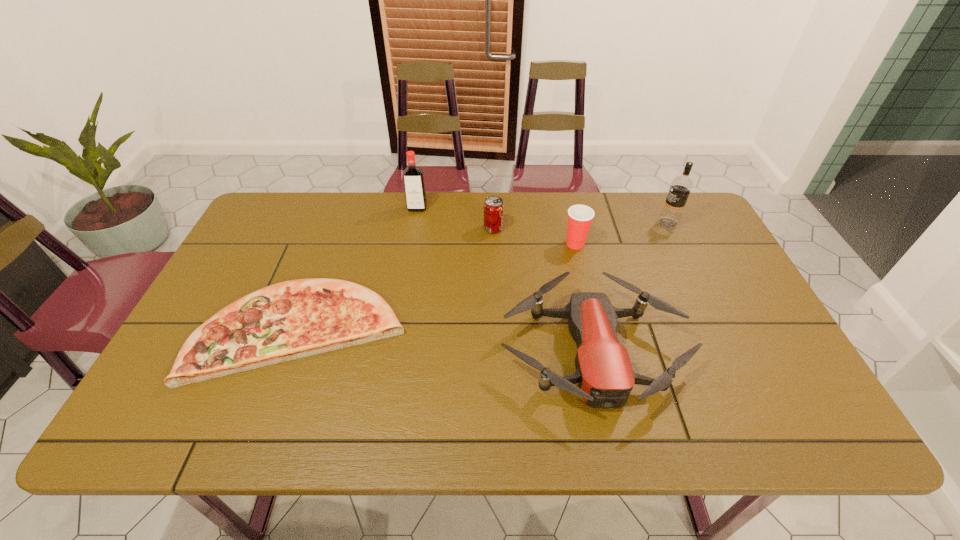
Image resolution: width=960 pixels, height=540 pixels. Identify the location of the right vodka. (681, 186).

Find the location of a particular element. This screenshot has height=540, width=960. the rightmost object is located at coordinates (681, 186).

Image resolution: width=960 pixels, height=540 pixels. Find the location of `the left vodka`. the left vodka is located at coordinates (414, 187).

Image resolution: width=960 pixels, height=540 pixels. In order to click on the farthest object in this screenshot , I will do `click(414, 187)`.

You are a GUI agent. You are given a task and a screenshot of the screen. Output one action in this format:
    pyautogui.click(x=<x>, y=<y>)
    Task: Click on the Dixie cup
    
    Given the screenshot: What is the action you would take?
    (x=580, y=217)

The width and height of the screenshot is (960, 540). In order to click on pop soda in this screenshot , I will do [493, 215].

Identify the location of drone. This screenshot has width=960, height=540. (604, 373).

Where is `the shortest object`? This screenshot has height=540, width=960. the shortest object is located at coordinates (298, 318).

At what (x,y) coordinates should I click in order to perform the action: click on vacant space located 0.370m on the label of the rightmost object. Please return your answer as a coordinate pair (x, y). This screenshot has height=540, width=960. Looking at the image, I should click on (541, 223).

Image resolution: width=960 pixels, height=540 pixels. Identify the location of vacant region located 0.260m on the label of the rightmost object. (576, 223).